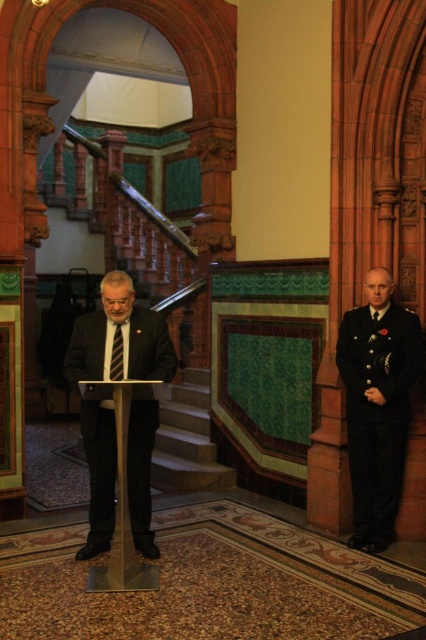
Question: Which object is the farthest from the black silk tie at center?

Choices:
 (A) gold metallic podium at center
 (B) stone stairs at center

Answer: (B)

Question: Is dark suit at center smaller than black silk tie at center?

Choices:
 (A) no
 (B) yes

Answer: (A)

Question: Is dark suit at center further to camera compared to stone stairs at center?

Choices:
 (A) yes
 (B) no

Answer: (B)

Question: Does stone stairs at center appear on the right side of gold metallic podium at center?

Choices:
 (A) yes
 (B) no

Answer: (A)

Question: Which of the following is the closest to the observer?

Choices:
 (A) gold metallic podium at center
 (B) dark blue uniform at right
 (C) black silk tie at center

Answer: (A)

Question: Which object is positioned farthest from the gold metallic podium at center?

Choices:
 (A) stone stairs at center
 (B) dark suit at center

Answer: (A)